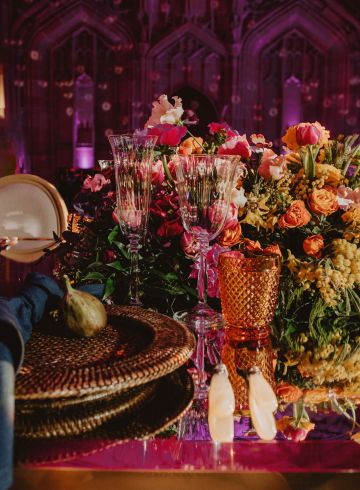
At what (x,y) coordinates should I click in order to perform the action: click on highball glass. Please return your answer as a coordinate pair (x, y). Image resolution: width=360 pixels, height=490 pixels. Looking at the image, I should click on (253, 293).